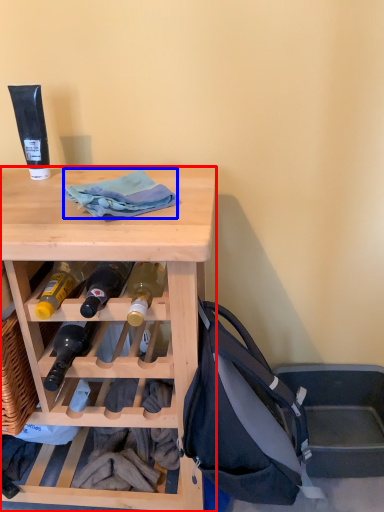
Question: Which object is further to the camera taking this photo, desk (highlighted by a red box) or cloth (highlighted by a blue box)?

Choices:
 (A) desk
 (B) cloth

Answer: (B)